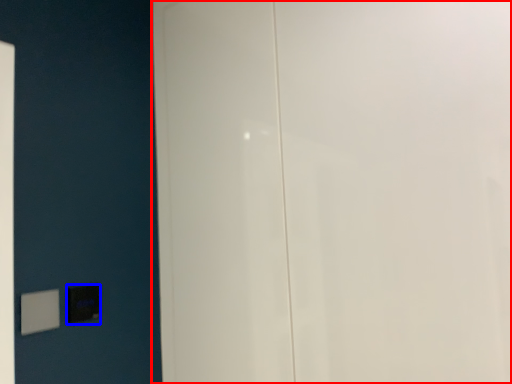
Question: Among these objects, which one is nearest to the camera, door (highlighted by a red box) or light switch (highlighted by a blue box)?

Choices:
 (A) door
 (B) light switch

Answer: (A)